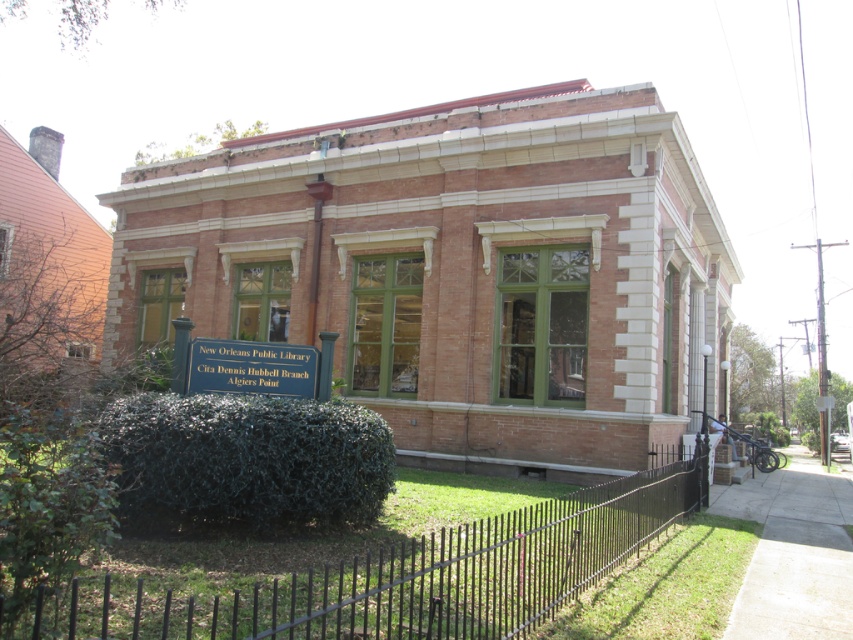
You are standing in front of the library and notice two points marked on the ground. One is at point [297,515] and the other at point [285,372]. Which point is closer to the entrance of the library?

Point [297,515] is in front of point [285,372], so it is closer to the entrance of the library.

You are a gardener planning to trim the dark green bush at lower left and the metallic silver sign at center. Based on their widths, which one requires more attention to avoid overgrowth?

The dark green bush at lower left might be wider than the metallic silver sign at center, so it requires more attention to avoid overgrowth.